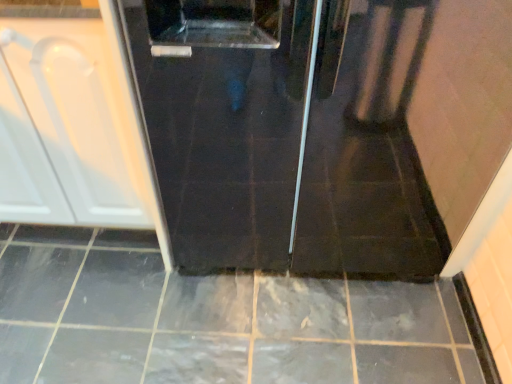
Where is `white glossy cabinet at left`? This screenshot has height=384, width=512. white glossy cabinet at left is located at coordinates (77, 116).

Describe the element at coordinates (77, 116) in the screenshot. The image size is (512, 384). I see `white glossy cabinet at left` at that location.

What do you see at coordinates (211, 320) in the screenshot? I see `glossy ceramic tile at center` at bounding box center [211, 320].

The height and width of the screenshot is (384, 512). In order to click on glossy ceramic tile at center in this screenshot , I will do `click(211, 320)`.

Measure the distance between glossy ceramic tile at center and camera.

The distance of glossy ceramic tile at center from camera is 1.23 meters.

This screenshot has height=384, width=512. In order to click on white glossy cabinet at left in this screenshot , I will do `click(77, 116)`.

Which is more to the right, glossy ceramic tile at center or white glossy cabinet at left?

Positioned to the right is glossy ceramic tile at center.

Which is behind, glossy ceramic tile at center or white glossy cabinet at left?

glossy ceramic tile at center is more distant.

Does point (34, 306) come closer to viewer compared to point (23, 71)?

No, (34, 306) is behind (23, 71).

From the image's perspective, which one is positioned lower, glossy ceramic tile at center or white glossy cabinet at left?

From the image's view, glossy ceramic tile at center is below.

From a real-world perspective, which is physically below, glossy ceramic tile at center or white glossy cabinet at left?

From a 3D spatial view, glossy ceramic tile at center is below.

Considering the sizes of objects glossy ceramic tile at center and white glossy cabinet at left in the image provided, who is wider, glossy ceramic tile at center or white glossy cabinet at left?

glossy ceramic tile at center is wider.

Considering the relative sizes of glossy ceramic tile at center and white glossy cabinet at left in the image provided, is glossy ceramic tile at center taller than white glossy cabinet at left?

No, glossy ceramic tile at center is not taller than white glossy cabinet at left.

Can you confirm if glossy ceramic tile at center is bigger than white glossy cabinet at left?

Incorrect, glossy ceramic tile at center is not larger than white glossy cabinet at left.

Consider the image. Can white glossy cabinet at left be found inside glossy ceramic tile at center?

No.

Does glossy ceramic tile at center touch white glossy cabinet at left?

No, glossy ceramic tile at center is not next to white glossy cabinet at left.

Is glossy ceramic tile at center facing towards white glossy cabinet at left?

No.

How different are the orientations of glossy ceramic tile at center and white glossy cabinet at left in degrees?

2.55 degrees.

Where is `ceramic tile that appears behind the white glossy cabinet at left`? ceramic tile that appears behind the white glossy cabinet at left is located at coordinates (211, 320).

Is white glossy cabinet at left to the left or to the right of glossy ceramic tile at center in the image?

white glossy cabinet at left is positioned on glossy ceramic tile at center's left side.

Is the position of white glossy cabinet at left more distant than that of glossy ceramic tile at center?

No, white glossy cabinet at left is closer to the viewer.

Which point is more forward, (23, 102) or (194, 374)?

Point (23, 102)

From the image's perspective, would you say white glossy cabinet at left is positioned over glossy ceramic tile at center?

Yes, from the image's perspective, white glossy cabinet at left is above glossy ceramic tile at center.

From a real-world perspective, who is located higher, white glossy cabinet at left or glossy ceramic tile at center?

white glossy cabinet at left.

Looking at their sizes, would you say white glossy cabinet at left is wider or thinner than glossy ceramic tile at center?

Considering their sizes, white glossy cabinet at left looks slimmer than glossy ceramic tile at center.

Who is shorter, white glossy cabinet at left or glossy ceramic tile at center?

With less height is glossy ceramic tile at center.

Who is bigger, white glossy cabinet at left or glossy ceramic tile at center?

white glossy cabinet at left.

Can we say white glossy cabinet at left lies outside glossy ceramic tile at center?

Absolutely, white glossy cabinet at left is external to glossy ceramic tile at center.

Is white glossy cabinet at left in contact with glossy ceramic tile at center?

No, white glossy cabinet at left is not beside glossy ceramic tile at center.

Could you tell me if white glossy cabinet at left is turned towards glossy ceramic tile at center?

No.

How distant is white glossy cabinet at left from glossy ceramic tile at center?

They are 20.46 inches apart.

There is a glossy ceramic tile at center. Where is `cabinetry above it (from a real-world perspective)`? The height and width of the screenshot is (384, 512). cabinetry above it (from a real-world perspective) is located at coordinates (77, 116).

Locate an element on the screen. This screenshot has width=512, height=384. cabinetry in front of the glossy ceramic tile at center is located at coordinates (77, 116).

Identify the location of cabinetry lying above the glossy ceramic tile at center (from the image's perspective). The height and width of the screenshot is (384, 512). coord(77,116).